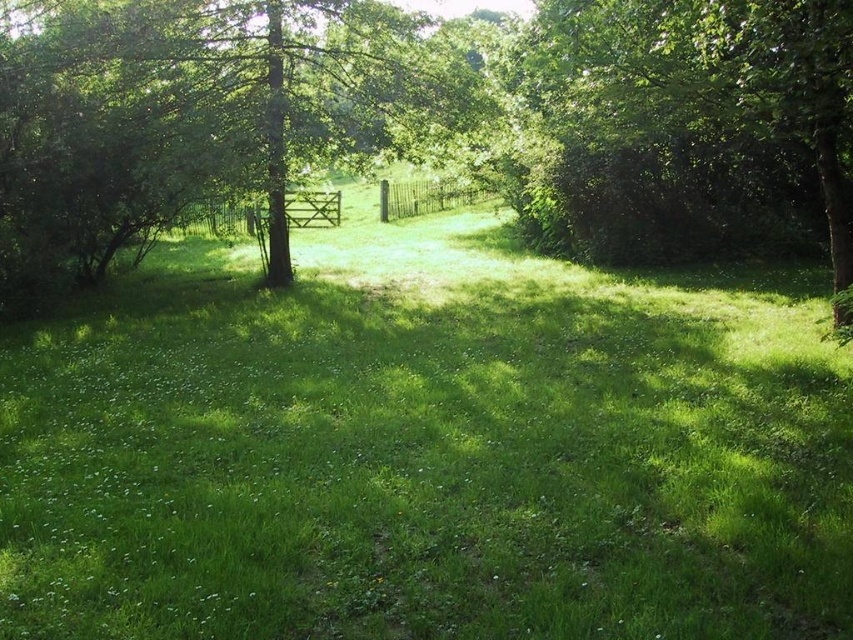
Which is below, green grassy at center or green leafy tree at center?

green grassy at center is below.

Can you confirm if green grassy at center is positioned above green leafy tree at center?

No.

Does point (119, 632) come closer to viewer compared to point (68, 164)?

Yes, it is.

You are a GUI agent. You are given a task and a screenshot of the screen. Output one action in this format:
    pyautogui.click(x=<x>, y=<y>)
    Task: Click on the green grassy at center
    
    Given the screenshot: What is the action you would take?
    pyautogui.click(x=424, y=449)

Is green wooden gate at center positioned in front of green wooden fence at center?

Yes, green wooden gate at center is in front of green wooden fence at center.

Does green wooden gate at center have a lesser height compared to green wooden fence at center?

No.

Consider the image. Who is more forward, (202,221) or (415,179)?

Point (202,221) is in front.

What are the coordinates of `green wooden gate at center` in the screenshot? It's located at (219, 218).

Between point (836, 273) and point (434, 193), which one is positioned in front?

Point (836, 273) is more forward.

Locate an element on the screen. The image size is (853, 640). green leafy tree at upper right is located at coordinates (711, 93).